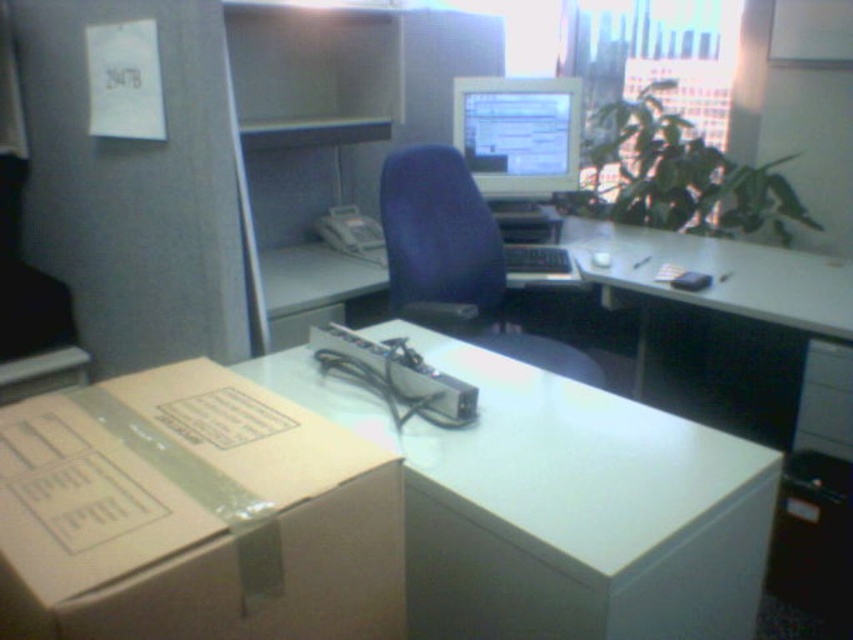
Question: Based on their relative distances, which object is nearer to the white glossy table at center?

Choices:
 (A) brown cardboard box at lower left
 (B) matte gray monitor at center

Answer: (A)

Question: Which object appears farthest from the camera in this image?

Choices:
 (A) matte blue swivel chair at center
 (B) matte gray monitor at center
 (C) white glossy table at center
 (D) brown cardboard box at lower left

Answer: (B)

Question: Is brown cardboard box at lower left above white glossy table at center?

Choices:
 (A) yes
 (B) no

Answer: (A)

Question: Considering the relative positions of brown cardboard box at lower left and matte gray monitor at center in the image provided, where is brown cardboard box at lower left located with respect to matte gray monitor at center?

Choices:
 (A) left
 (B) right

Answer: (A)

Question: In this image, where is white glossy table at center located relative to matte gray monitor at center?

Choices:
 (A) left
 (B) right

Answer: (A)

Question: Which point is closer to the camera?

Choices:
 (A) matte gray monitor at center
 (B) white glossy table at center

Answer: (B)